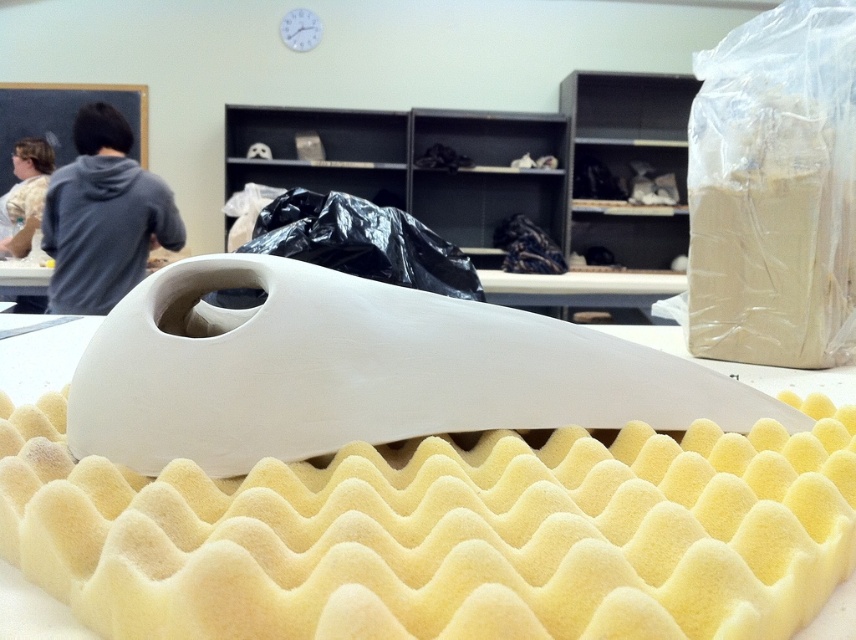
Does black plastic bag at center have a lesser width compared to white cotton shirt at left?

No.

Is black plastic bag at center shorter than white cotton shirt at left?

Correct, black plastic bag at center is not as tall as white cotton shirt at left.

Is point (441, 289) in front of point (28, 212)?

Yes, point (441, 289) is in front of point (28, 212).

The image size is (856, 640). In order to click on black plastic bag at center in this screenshot , I will do `click(361, 243)`.

Who is positioned more to the left, white foam at center or white cotton shirt at left?

From the viewer's perspective, white cotton shirt at left appears more on the left side.

The image size is (856, 640). Describe the element at coordinates (444, 548) in the screenshot. I see `white foam at center` at that location.

Is point (186, 477) positioned after point (10, 212)?

No, it is not.

Find the location of `white foam at center`. white foam at center is located at coordinates (444, 548).

Does point (64, 300) come closer to viewer compared to point (34, 163)?

Yes, it is.

From the picture: Does gray hoodie at upper left have a lesser height compared to white cotton shirt at left?

No, gray hoodie at upper left is not shorter than white cotton shirt at left.

The image size is (856, 640). What do you see at coordinates (103, 216) in the screenshot? I see `gray hoodie at upper left` at bounding box center [103, 216].

This screenshot has height=640, width=856. I want to click on gray hoodie at upper left, so click(103, 216).